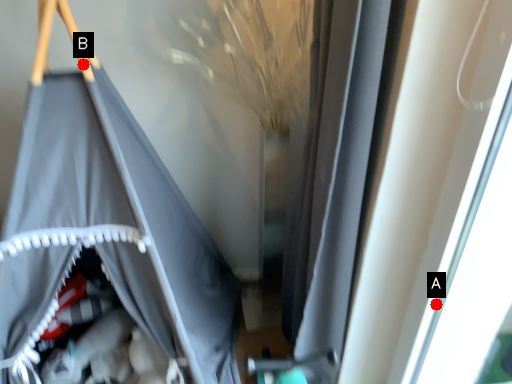
Question: Two points are circled on the image, labeled by A and B beside each circle. Which of the following is the farthest from the observer?

Choices:
 (A) A is further
 (B) B is further

Answer: (A)